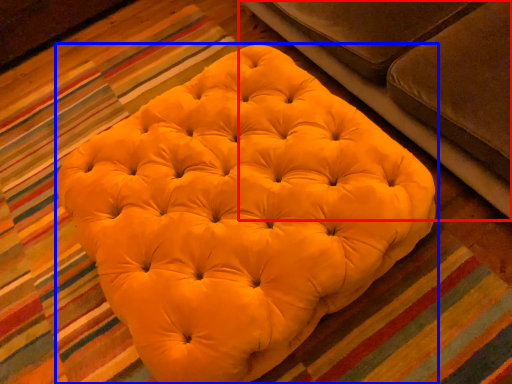
Question: Which object is closer to the camera taking this photo, studio couch (highlighted by a red box) or furniture (highlighted by a blue box)?

Choices:
 (A) studio couch
 (B) furniture

Answer: (A)